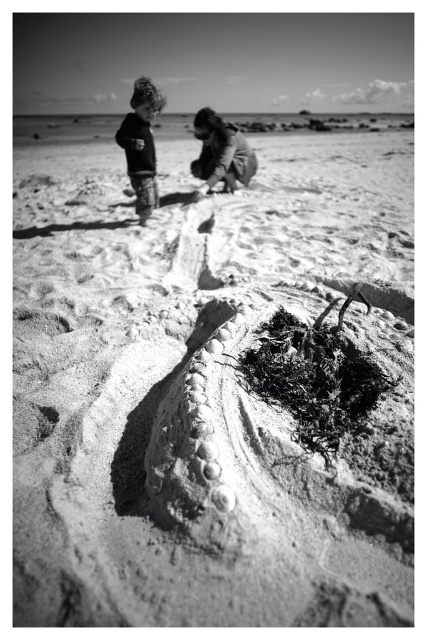
Question: Which object is closer to the camera taking this photo?

Choices:
 (A) matte black jacket at upper left
 (B) smooth fabric child at upper center

Answer: (A)

Question: Which point is farther from the camera taking this photo?

Choices:
 (A) (225, 164)
 (B) (129, 180)

Answer: (B)

Question: Is matte black jacket at upper left closer to the viewer compared to smooth fabric child at upper center?

Choices:
 (A) yes
 (B) no

Answer: (A)

Question: In this image, where is matte black jacket at upper left located relative to smooth fabric child at upper center?

Choices:
 (A) above
 (B) below

Answer: (B)

Question: Does matte black jacket at upper left lie in front of smooth fabric child at upper center?

Choices:
 (A) no
 (B) yes

Answer: (B)